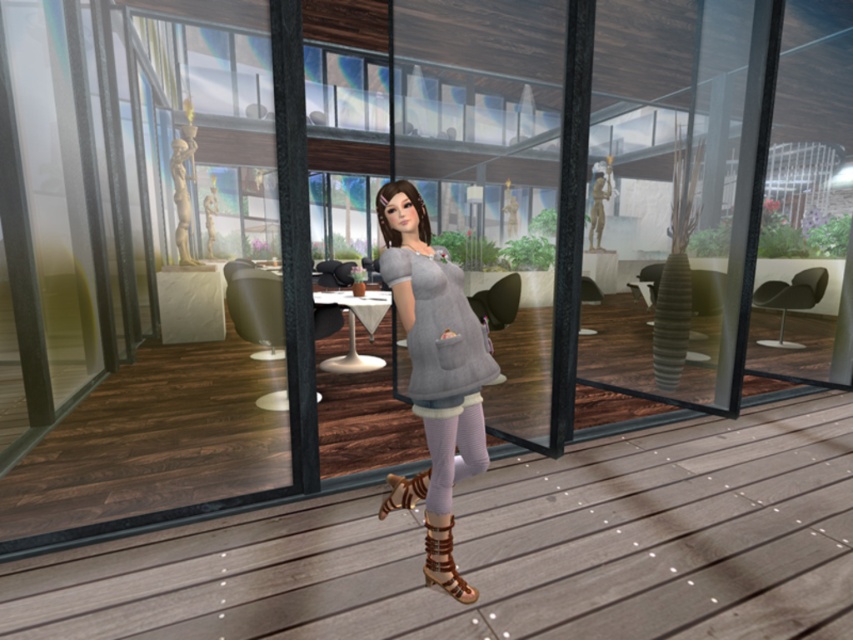
Is point (456, 426) positioned before point (397, 502)?

That is True.

Is gray fabric dress at center shorter than zebra-patterned leather boot at lower center?

No, gray fabric dress at center is not shorter than zebra-patterned leather boot at lower center.

Which is in front, point (418, 346) or point (408, 492)?

Point (418, 346)

At what (x,y) coordinates should I click in order to perform the action: click on gray fabric dress at center. Please return your answer as a coordinate pair (x, y). Looking at the image, I should click on (434, 372).

Locate an element on the screen. Image resolution: width=853 pixels, height=640 pixels. gray matte dress at center is located at coordinates (439, 328).

Between wooden deck at center and zebra-patterned leather boot at lower center, which one has less height?

With less height is zebra-patterned leather boot at lower center.

Which is in front, point (291, 604) or point (392, 476)?

Point (291, 604) is in front.

Who is more distant from viewer, (845, 481) or (410, 499)?

The point (845, 481) is more distant.

The image size is (853, 640). I want to click on wooden deck at center, so click(506, 548).